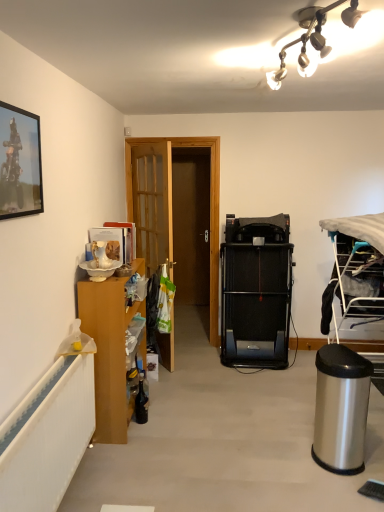
Question: Is wooden door at center inside the boundaries of white glass light fixture at upper center, or outside?

Choices:
 (A) outside
 (B) inside

Answer: (A)

Question: From the image's perspective, is wooden door at center above or below white glass light fixture at upper center?

Choices:
 (A) above
 (B) below

Answer: (B)

Question: Estimate the real-world distances between objects in this image. Which object is closer to the black rubber treadmill at center?

Choices:
 (A) white glass light fixture at upper center
 (B) metallic silver picture frame at upper left
 (C) silver metallic trash can at lower right
 (D) wooden door at center
 (E) wooden cabinet at left

Answer: (D)

Question: Considering the real-world distances, which object is farthest from the silver metallic trash can at lower right?

Choices:
 (A) wooden door at center
 (B) wooden cabinet at left
 (C) black rubber treadmill at center
 (D) white glass light fixture at upper center
 (E) silver metallic trash can at lower right

Answer: (B)